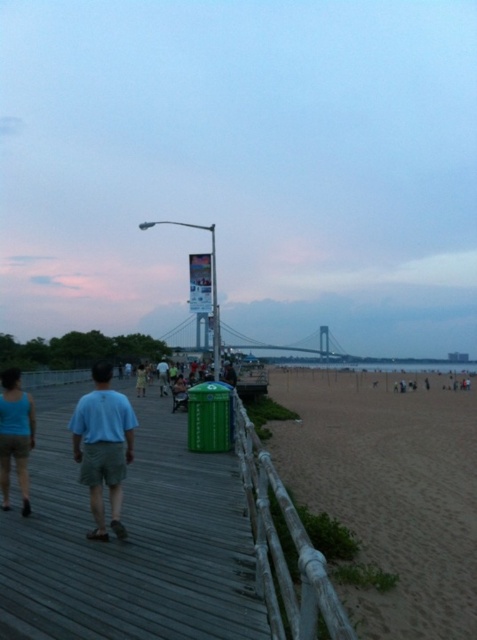
This screenshot has width=477, height=640. Describe the element at coordinates (390, 492) in the screenshot. I see `sandy beach at lower right` at that location.

Looking at this image, is sandy beach at lower right wider than light blue cotton shirt at center?

Indeed, sandy beach at lower right has a greater width compared to light blue cotton shirt at center.

Is point (473, 627) positioned after point (90, 426)?

Yes.

Where is `sandy beach at lower right`? sandy beach at lower right is located at coordinates (390, 492).

Between matte blue tank top at left and light blue t-shirt at center, which one appears on the right side from the viewer's perspective?

matte blue tank top at left is more to the right.

The image size is (477, 640). What do you see at coordinates (14, 435) in the screenshot?
I see `matte blue tank top at left` at bounding box center [14, 435].

Where is `matte blue tank top at left`? matte blue tank top at left is located at coordinates (14, 435).

Does weathered wood rail at lower center come behind light blue t-shirt at center?

No, weathered wood rail at lower center is in front of light blue t-shirt at center.

The width and height of the screenshot is (477, 640). Describe the element at coordinates (283, 548) in the screenshot. I see `weathered wood rail at lower center` at that location.

I want to click on weathered wood rail at lower center, so click(x=283, y=548).

At what (x,y) coordinates should I click in order to perform the action: click on weathered wood rail at lower center. Please return your answer as a coordinate pair (x, y). Image resolution: width=477 pixels, height=640 pixels. Looking at the image, I should click on (283, 548).